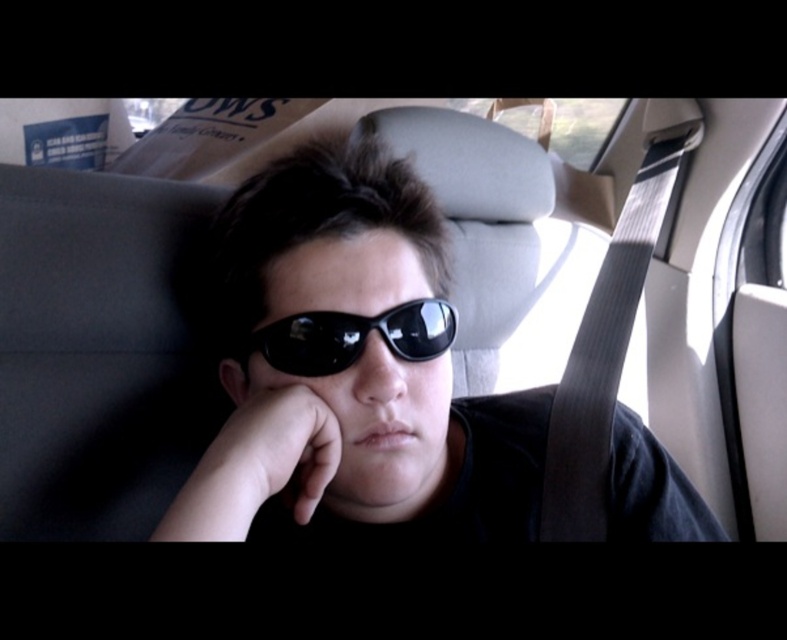
You are a passenger in the car and want to hand the driver the matte black sunglasses at center. Which direction should you move your hand to pass it to the driver, considering the position of the black reflective sunglasses at center?

The matte black sunglasses at center is to the left of the black reflective sunglasses at center. To pass the matte black sunglasses at center to the driver, you should move your hand to the right towards the driver since the matte black sunglasses is positioned to the left of the other sunglasses.